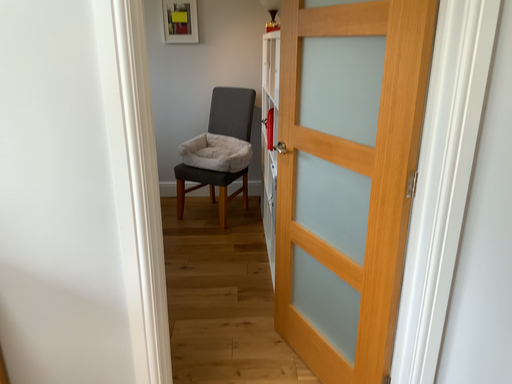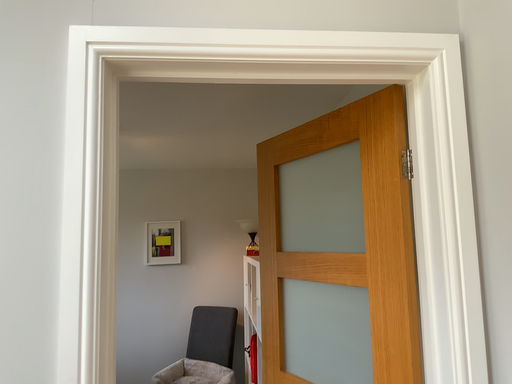
Question: Which way did the camera rotate in the video?

Choices:
 (A) rotated downward
 (B) rotated upward

Answer: (B)